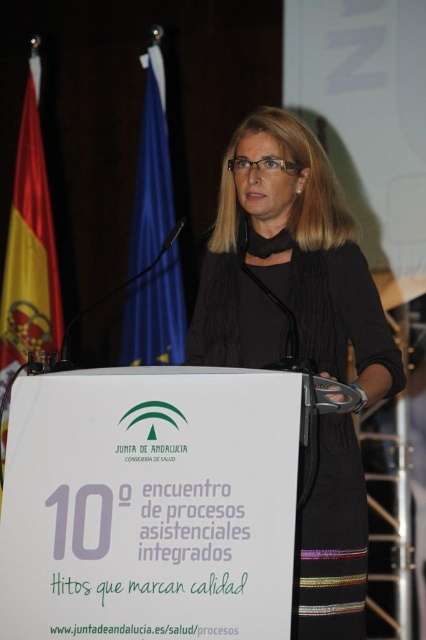
Question: Can you confirm if black matte dress at center is positioned to the left of red fabric flag at left?

Choices:
 (A) yes
 (B) no

Answer: (B)

Question: Which of these objects is positioned closest to the red fabric flag at left?

Choices:
 (A) blue fabric flag at upper left
 (B) black matte dress at center

Answer: (A)

Question: Which of these objects is positioned farthest from the blue fabric flag at upper left?

Choices:
 (A) red fabric flag at left
 (B) black matte dress at center

Answer: (B)

Question: Which object appears farthest from the camera in this image?

Choices:
 (A) black matte dress at center
 (B) blue fabric flag at upper left

Answer: (B)

Question: Does blue fabric flag at upper left have a greater width compared to red fabric flag at left?

Choices:
 (A) yes
 (B) no

Answer: (A)

Question: Where is blue fabric flag at upper left located in relation to red fabric flag at left in the image?

Choices:
 (A) above
 (B) below

Answer: (A)